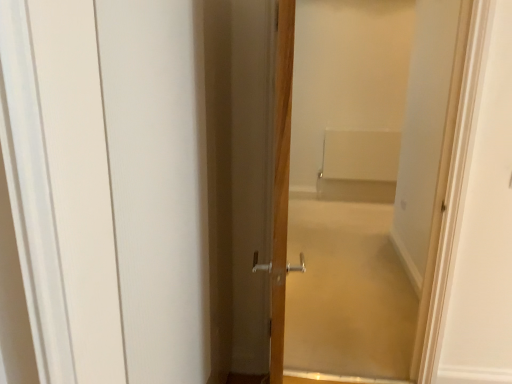
Question: Can you confirm if wooden door at center, positioned as the 2th door in right-to-left order, is thinner than white matte barn door at left?

Choices:
 (A) yes
 (B) no

Answer: (B)

Question: Considering the relative positions of wooden door at center, marked as the 1th door in a left-to-right arrangement, and white matte barn door at left in the image provided, is wooden door at center, marked as the 1th door in a left-to-right arrangement, to the right of white matte barn door at left from the viewer's perspective?

Choices:
 (A) yes
 (B) no

Answer: (A)

Question: From a real-world perspective, is wooden door at center, marked as the 1th door in a left-to-right arrangement, physically above white matte barn door at left?

Choices:
 (A) no
 (B) yes

Answer: (B)

Question: From a real-world perspective, is wooden door at center, marked as the 1th door in a left-to-right arrangement, under white matte barn door at left?

Choices:
 (A) yes
 (B) no

Answer: (B)

Question: Is wooden door at center, positioned as the 2th door in right-to-left order, taller than white matte barn door at left?

Choices:
 (A) yes
 (B) no

Answer: (A)

Question: Is white matte barn door at left wider or thinner than wooden door at center, marked as the 1th door in a left-to-right arrangement?

Choices:
 (A) thin
 (B) wide

Answer: (A)

Question: From a real-world perspective, is white matte barn door at left physically located above or below wooden door at center, marked as the 1th door in a left-to-right arrangement?

Choices:
 (A) below
 (B) above

Answer: (A)

Question: From the image's perspective, is white matte barn door at left positioned above or below wooden door at center, marked as the 1th door in a left-to-right arrangement?

Choices:
 (A) below
 (B) above

Answer: (A)

Question: Is white matte barn door at left situated inside wooden door at center, marked as the 1th door in a left-to-right arrangement, or outside?

Choices:
 (A) inside
 (B) outside

Answer: (B)

Question: Would you say wooden door at center, marked as the 1th door in a left-to-right arrangement, is to the left or to the right of white matte barn door at left in the picture?

Choices:
 (A) left
 (B) right

Answer: (B)

Question: Considering the positions of wooden door at center, marked as the 1th door in a left-to-right arrangement, and white matte barn door at left in the image, is wooden door at center, marked as the 1th door in a left-to-right arrangement, taller or shorter than white matte barn door at left?

Choices:
 (A) tall
 (B) short

Answer: (A)

Question: Is point (256, 92) closer or farther from the camera than point (138, 294)?

Choices:
 (A) closer
 (B) farther

Answer: (B)

Question: From a real-world perspective, relative to white matte barn door at left, is wooden door at center, marked as the 1th door in a left-to-right arrangement, vertically above or below?

Choices:
 (A) above
 (B) below

Answer: (A)

Question: Considering the positions of point (96, 193) and point (309, 319), is point (96, 193) closer or farther from the camera than point (309, 319)?

Choices:
 (A) closer
 (B) farther

Answer: (A)

Question: Is white matte barn door at left inside or outside of wooden door at center, placed as the 1th door when sorted from right to left?

Choices:
 (A) outside
 (B) inside

Answer: (A)